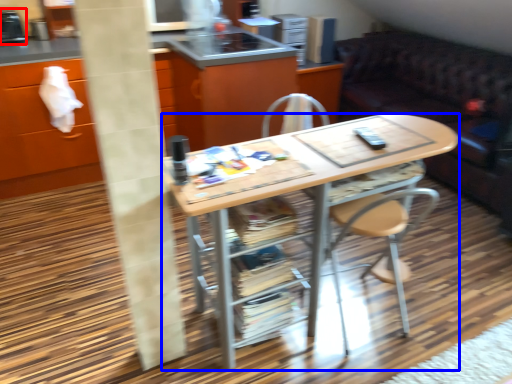
Question: Which object is closer to the camera taking this photo, appliance (highlighted by a red box) or desk (highlighted by a blue box)?

Choices:
 (A) appliance
 (B) desk

Answer: (B)